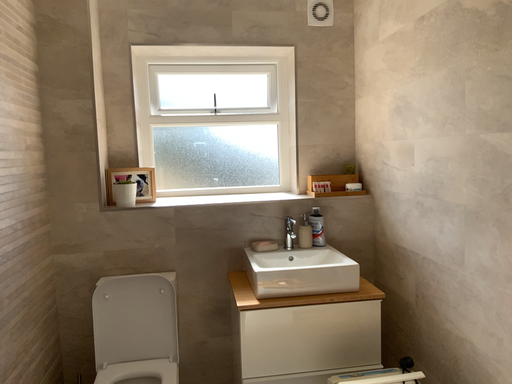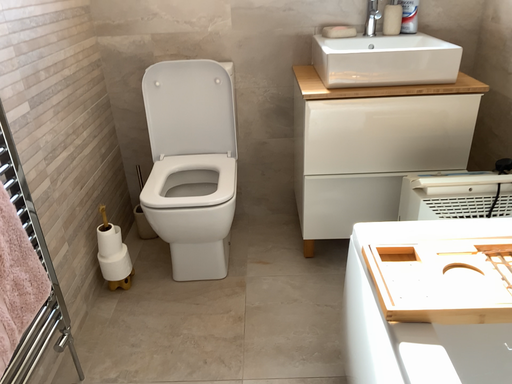
Question: How did the camera likely rotate when shooting the video?

Choices:
 (A) rotated left
 (B) rotated right

Answer: (A)